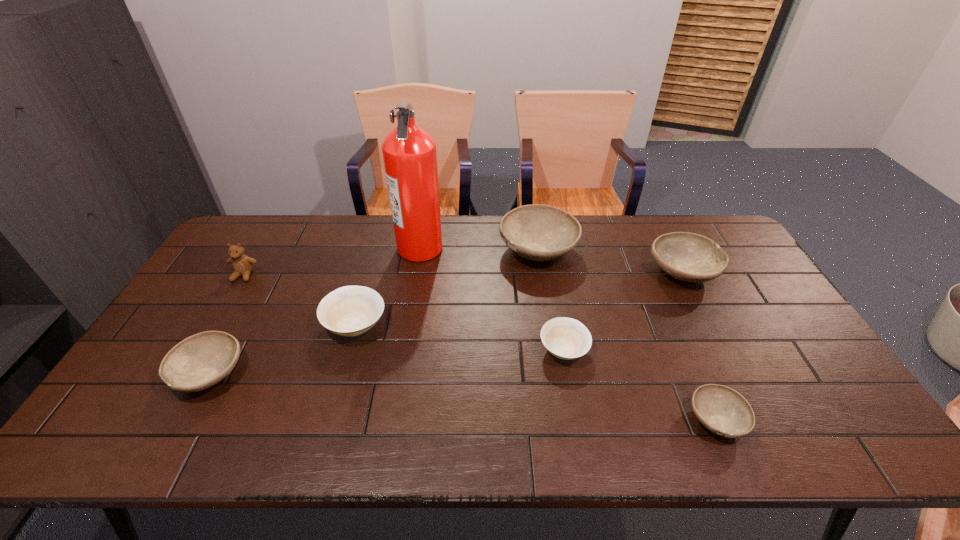
What are the coordinates of `free space between the leftmost gray bowl and the smallest gray bowl` in the screenshot? It's located at (463, 397).

Image resolution: width=960 pixels, height=540 pixels. In order to click on unoccupied area between the teddy bear and the tallest object in this screenshot , I will do `click(332, 261)`.

You are a GUI agent. You are given a task and a screenshot of the screen. Output one action in this format:
    pyautogui.click(x=<x>, y=<y>)
    Task: Click on the empty location between the smaller beige bowl and the bigger beige bowl
    
    Given the screenshot: What is the action you would take?
    pyautogui.click(x=460, y=338)

The height and width of the screenshot is (540, 960). What are the coordinates of `empty space that is in between the teddy bear and the smaller beige bowl` in the screenshot? It's located at (404, 313).

Identify the location of free spot between the teddy bear and the right beige bowl. (404, 313).

Identify the location of free space that is in between the bigger beige bowl and the second biggest gray bowl. This screenshot has height=540, width=960. (518, 299).

Identify the location of the fourth closest object to the fire extinguisher. The image size is (960, 540). (x=242, y=265).

Choose which object is the third nearest neighbor to the third smallest gray bowl. Please provide its 2D coordinates. Your answer should be formatted as a tuple, i.e. [(x, y)], where the tuple contains the x and y coordinates of a point satisfying the conditions above.

[(722, 410)]

At what (x,y) coordinates should I click in order to perform the action: click on bowl object that ranks as the fourth closest to the second biggest gray bowl. Please return your answer as a coordinate pair (x, y). The width and height of the screenshot is (960, 540). Looking at the image, I should click on (350, 310).

The height and width of the screenshot is (540, 960). I want to click on bowl that is the closest to the third smallest gray bowl, so click(537, 232).